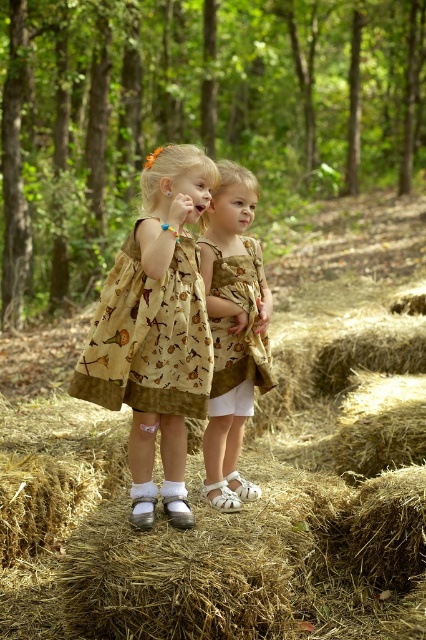
Question: Is golden straw bale at center below matte brown dress at center?

Choices:
 (A) no
 (B) yes

Answer: (B)

Question: Among these objects, which one is nearest to the camera?

Choices:
 (A) yellow cotton dress at center
 (B) golden straw bale at center
 (C) printed cotton dress at center
 (D) matte brown dress at center

Answer: (B)

Question: Among these objects, which one is nearest to the camera?

Choices:
 (A) yellow cotton dress at center
 (B) printed cotton dress at center

Answer: (A)

Question: Is golden straw bale at center to the right of matte brown dress at center from the viewer's perspective?

Choices:
 (A) no
 (B) yes

Answer: (B)

Question: Does yellow cotton dress at center appear on the left side of matte brown dress at center?

Choices:
 (A) yes
 (B) no

Answer: (A)

Question: Which object is farther from the camera taking this photo?

Choices:
 (A) matte brown dress at center
 (B) golden straw bale at center
 (C) printed cotton dress at center

Answer: (C)